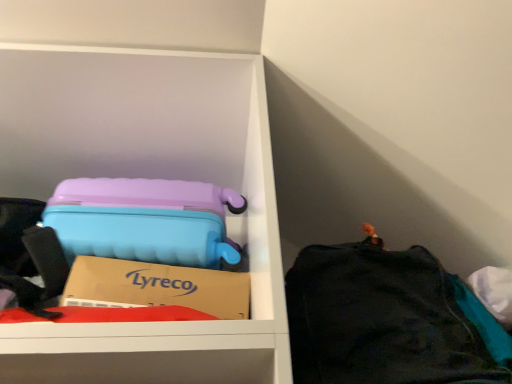
Question: Is black fabric bag at right inside or outside of matte plastic suitcase at upper left?

Choices:
 (A) inside
 (B) outside

Answer: (B)

Question: Relative to matte plastic suitcase at upper left, is black fabric bag at right in front or behind?

Choices:
 (A) front
 (B) behind

Answer: (A)

Question: Visually, is black fabric bag at right positioned to the left or to the right of matte plastic suitcase at upper left?

Choices:
 (A) right
 (B) left

Answer: (A)

Question: Looking at their shapes, would you say matte plastic suitcase at upper left is wider or thinner than black fabric bag at right?

Choices:
 (A) thin
 (B) wide

Answer: (A)

Question: Visually, is matte plastic suitcase at upper left positioned to the left or to the right of black fabric bag at right?

Choices:
 (A) left
 (B) right

Answer: (A)

Question: Considering the positions of point (133, 347) and point (462, 362), is point (133, 347) closer or farther from the camera than point (462, 362)?

Choices:
 (A) farther
 (B) closer

Answer: (B)

Question: From a real-world perspective, is matte plastic suitcase at upper left positioned above or below black fabric bag at right?

Choices:
 (A) above
 (B) below

Answer: (A)